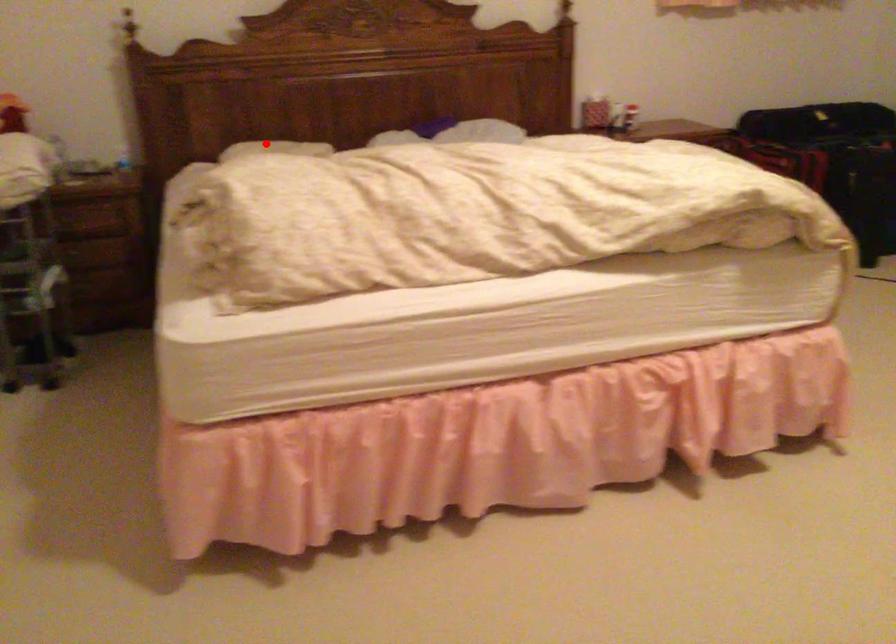
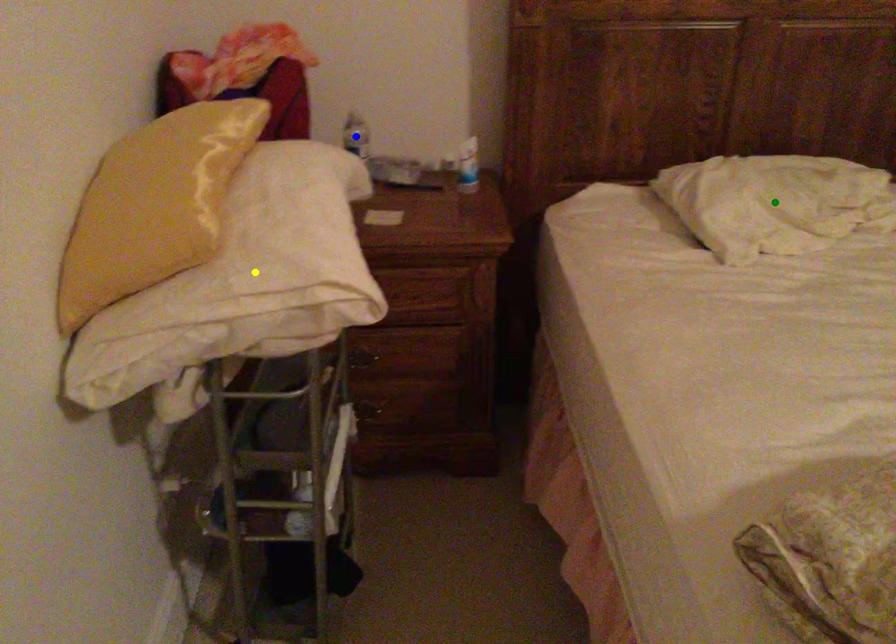
Question: I am providing you with two images of the same scene from different viewpoints. A red point is marked on the first image. You are given multiple points on the second image. Which spot in image 2 lines up with the point in image 1?

Choices:
 (A) blue point
 (B) yellow point
 (C) green point

Answer: (C)